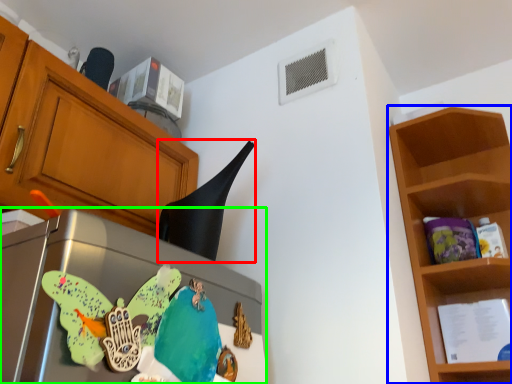
Question: Which is farther away from exhaust hood (highlighted by a red box)? shelf (highlighted by a blue box) or appliance (highlighted by a green box)?

Choices:
 (A) shelf
 (B) appliance

Answer: (A)